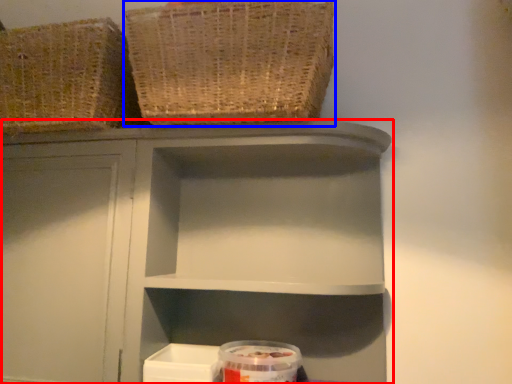
Question: Which point is further to the camera, shelf (highlighted by a red box) or basket (highlighted by a blue box)?

Choices:
 (A) shelf
 (B) basket

Answer: (A)